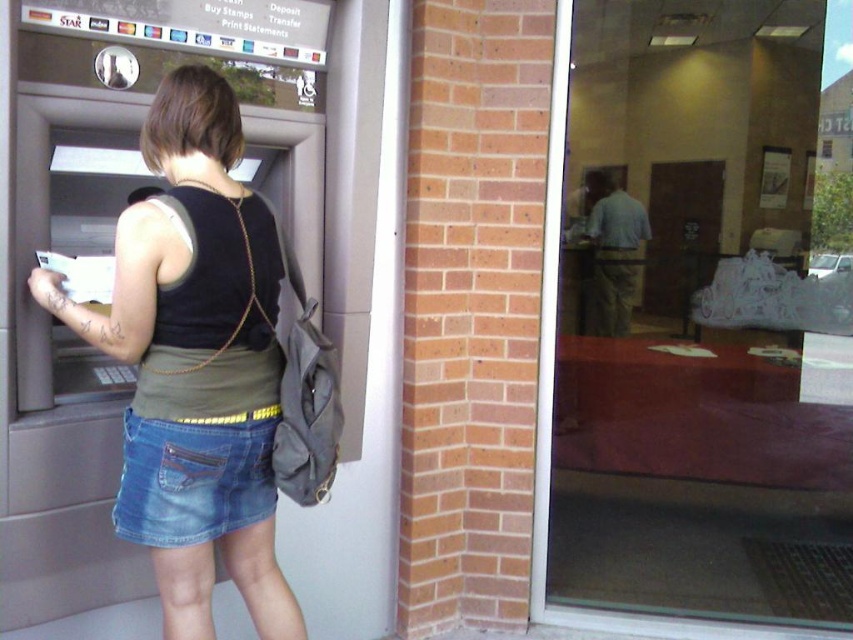
Is denim skirt at center to the right of jeans at lower left from the viewer's perspective?

Incorrect, denim skirt at center is not on the right side of jeans at lower left.

Which is behind, point (123, 282) or point (268, 483)?

Positioned behind is point (268, 483).

Locate an element on the screen. The width and height of the screenshot is (853, 640). denim skirt at center is located at coordinates pos(196,364).

Can you confirm if jeans at lower left is positioned to the left of black matte vest at back?

Correct, you'll find jeans at lower left to the left of black matte vest at back.

Consider the image. Can you confirm if jeans at lower left is positioned below black matte vest at back?

Indeed, jeans at lower left is positioned under black matte vest at back.

You are a GUI agent. You are given a task and a screenshot of the screen. Output one action in this format:
    pyautogui.click(x=<x>, y=<y>)
    Task: Click on the jeans at lower left
    This screenshot has width=853, height=640.
    Given the screenshot: What is the action you would take?
    pyautogui.click(x=192, y=481)

Image resolution: width=853 pixels, height=640 pixels. In order to click on denim skirt at center in this screenshot , I will do `click(196, 364)`.

In order to click on denim skirt at center in this screenshot , I will do `click(196, 364)`.

Locate an element on the screen. This screenshot has width=853, height=640. denim skirt at center is located at coordinates (196, 364).